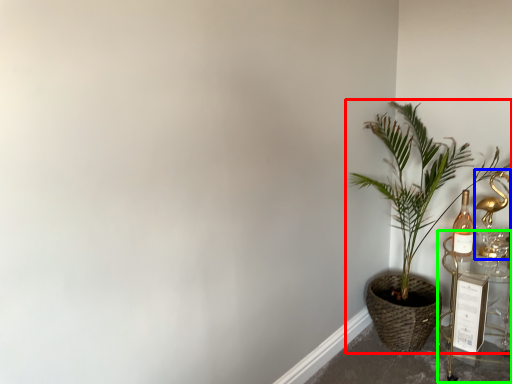
Question: Estimate the real-world distances between objects in this image. Which object is farther from houseplant (highlighted by a red box), candle holder (highlighted by a blue box) or table (highlighted by a green box)?

Choices:
 (A) candle holder
 (B) table

Answer: (A)